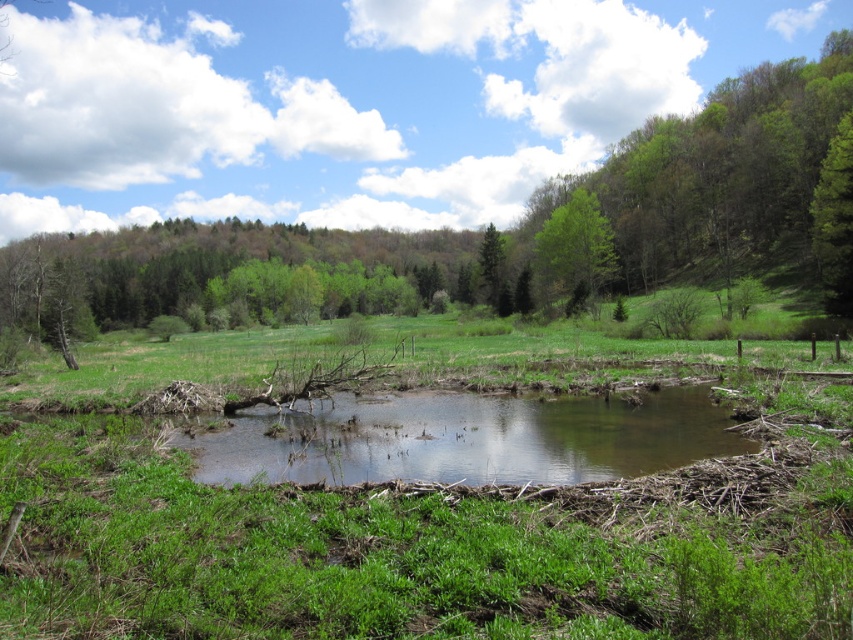
Does green leafy tree at center appear under green leafy tree at upper center?

Actually, green leafy tree at center is above green leafy tree at upper center.

Can you confirm if green leafy tree at center is positioned above green leafy tree at upper center?

Indeed, green leafy tree at center is positioned over green leafy tree at upper center.

Is point (131, 230) farther from camera compared to point (558, 216)?

Yes, it is behind point (558, 216).

What are the coordinates of `green leafy tree at center` in the screenshot? It's located at (718, 179).

Is green matte tree at upper right smaller than green matte tree at center?

No.

Between green matte tree at upper right and green matte tree at center, which one is positioned lower?

green matte tree at upper right

Identify the location of green matte tree at upper right. (834, 220).

Between brown muddy stream at center and green matte tree at upper right, which one is positioned lower?

Positioned lower is brown muddy stream at center.

Does brown muddy stream at center have a larger size compared to green matte tree at upper right?

No.

Describe the element at coordinates (462, 438) in the screenshot. I see `brown muddy stream at center` at that location.

At what (x,y) coordinates should I click in order to perform the action: click on brown muddy stream at center. Please return your answer as a coordinate pair (x, y). Looking at the image, I should click on coord(462,438).